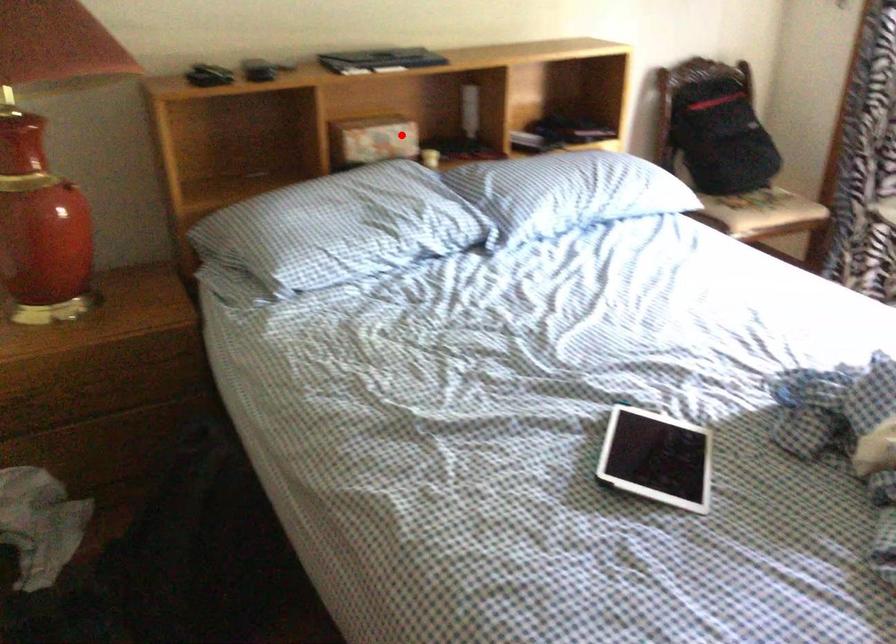
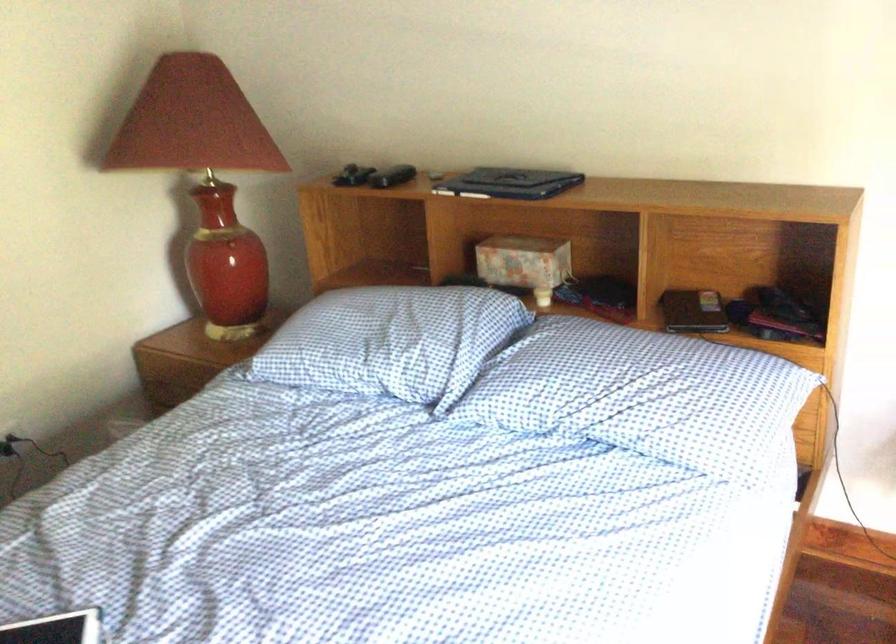
In the second image, find the point that corresponds to the highlighted location in the first image.

(524, 263)